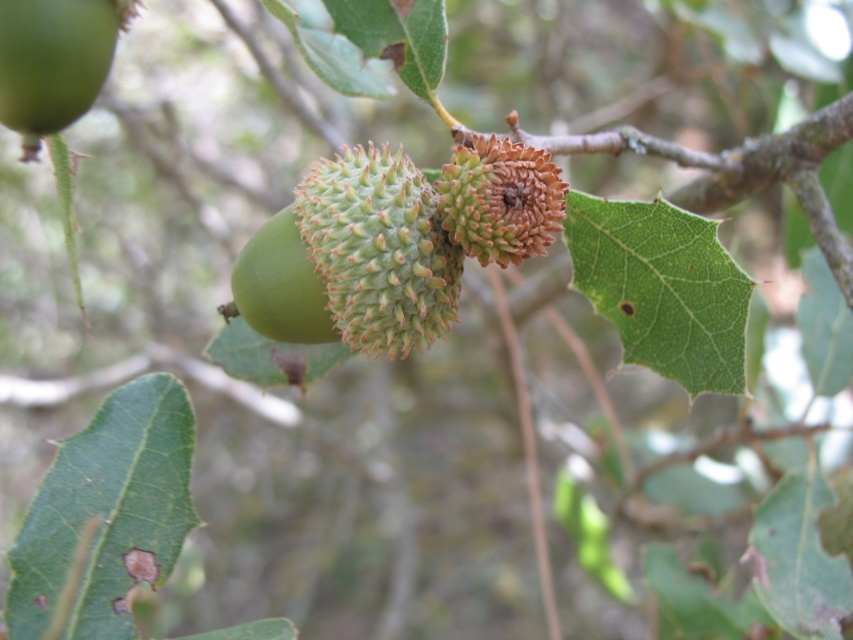
Who is positioned more to the right, green spiky acorn at center or brown spiky acorn at center?

brown spiky acorn at center

Is point (410, 163) positioned before point (453, 204)?

No.

I want to click on green spiky acorn at center, so click(x=379, y=250).

Consider the image. Who is shorter, green matte acorn at upper left or brown spiky acorn at center?

Standing shorter between the two is green matte acorn at upper left.

Is green matte acorn at upper left positioned in front of brown spiky acorn at center?

That is True.

Does point (73, 36) lie behind point (456, 230)?

No, it is not.

You are a GUI agent. You are given a task and a screenshot of the screen. Output one action in this format:
    pyautogui.click(x=<x>, y=<y>)
    Task: Click on the green matte acorn at upper left
    The width and height of the screenshot is (853, 640).
    Given the screenshot: What is the action you would take?
    [51, 60]

Is green spiky acorn at center closer to the viewer compared to green matte acorn at center?

Yes, it is.

Can you confirm if green spiky acorn at center is smaller than green matte acorn at center?

Actually, green spiky acorn at center might be larger than green matte acorn at center.

Does point (354, 269) come behind point (305, 298)?

No.

Locate an element on the screen. green spiky acorn at center is located at coordinates (379, 250).